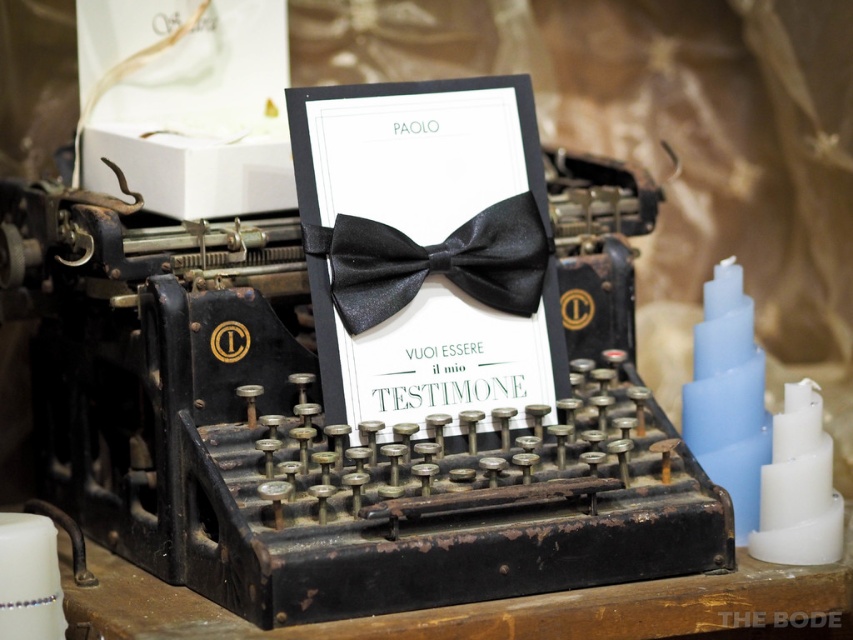
Question: Based on their relative distances, which object is nearer to the black satin bow tie at center?

Choices:
 (A) satin black bow tie at center
 (B) white matte candle at lower left

Answer: (A)

Question: Which point is closer to the camera?

Choices:
 (A) (396, 310)
 (B) (3, 516)
 (C) (357, 100)

Answer: (B)

Question: Is satin black bow tie at center to the right of black satin bow tie at center from the viewer's perspective?

Choices:
 (A) yes
 (B) no

Answer: (A)

Question: Which object is the closest to the black satin bow tie at center?

Choices:
 (A) satin black bow tie at center
 (B) white matte candle at lower left

Answer: (A)

Question: Can you confirm if black satin bow tie at center is positioned to the right of white matte candle at lower left?

Choices:
 (A) yes
 (B) no

Answer: (A)

Question: Does satin black bow tie at center appear under white matte candle at lower left?

Choices:
 (A) no
 (B) yes

Answer: (A)